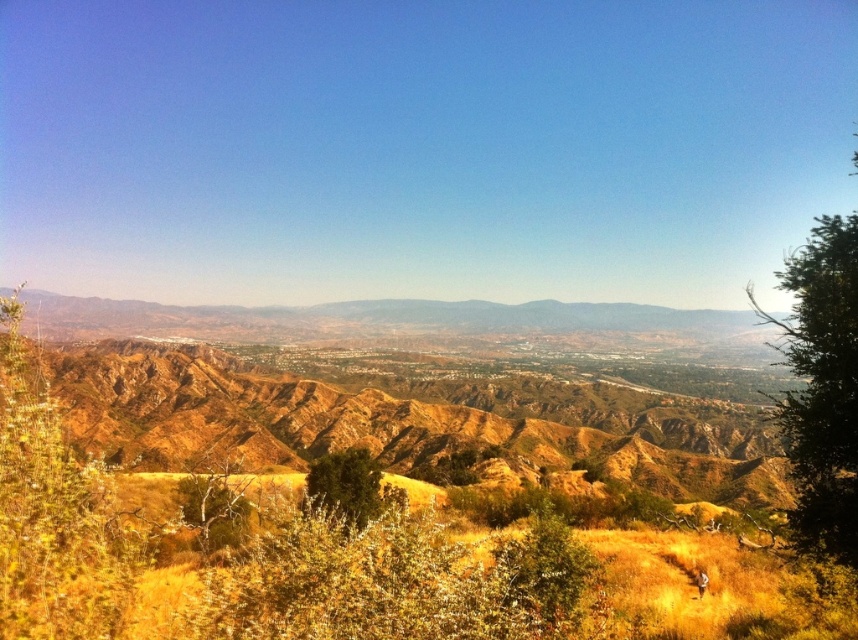
Consider the image. You are standing at the center of the image and want to find the green leafy shrub at lower left. In which direction should you look to see it?

The green leafy shrub at lower left is located at the lower left direction from your current position at the center of the image.

You are standing in the semi arid landscape and see the green leafy shrub at lower left and the brown textured tree at lower left. Which one is positioned more to the left side?

The green leafy shrub at lower left is positioned more to the left side than the brown textured tree at lower left.